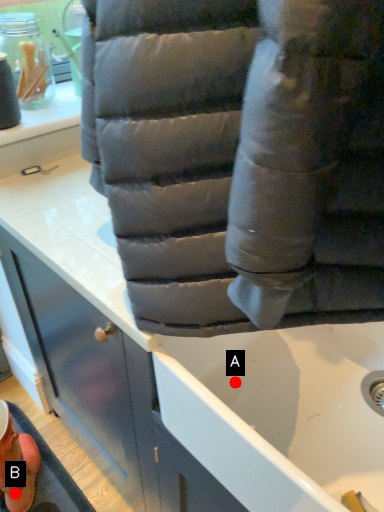
Question: Two points are circled on the image, labeled by A and B beside each circle. Which point is closer to the camera?

Choices:
 (A) A is closer
 (B) B is closer

Answer: (A)